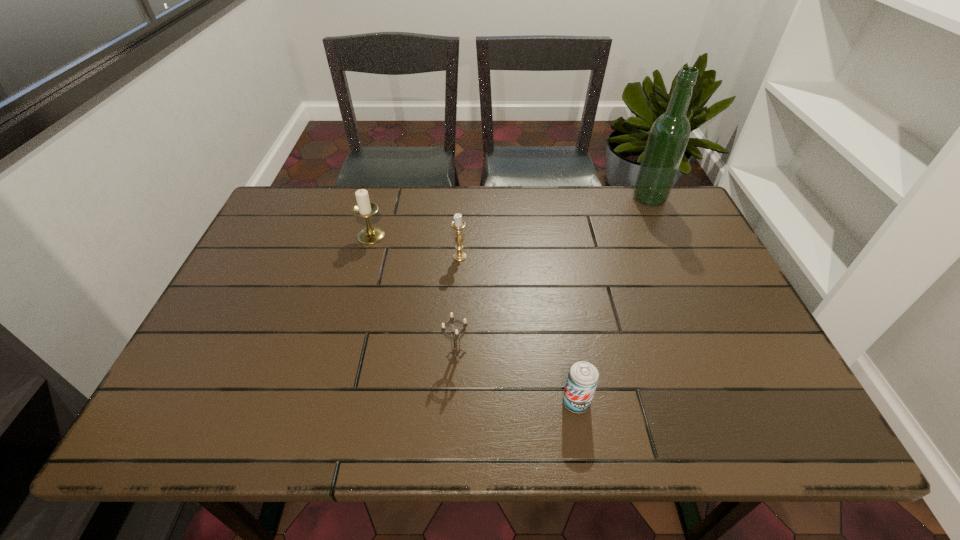
In order to click on vacant space that satisfies the following two spatial constraints: 1. on the front side of the nearest candle holder; 2. on the left side of the third farthest object in this screenshot , I will do `click(455, 355)`.

The height and width of the screenshot is (540, 960). I want to click on vacant space that satisfies the following two spatial constraints: 1. on the front side of the farthest candle holder; 2. on the right side of the shortest candle holder, so click(338, 355).

The width and height of the screenshot is (960, 540). What are the coordinates of `vacant space that satisfies the following two spatial constraints: 1. on the front side of the beer can; 2. on the right side of the third farthest object` in the screenshot? It's located at (453, 402).

Where is `vacant space that satisfies the following two spatial constraints: 1. on the front side of the nearest candle holder; 2. on the left side of the farthest candle holder`? vacant space that satisfies the following two spatial constraints: 1. on the front side of the nearest candle holder; 2. on the left side of the farthest candle holder is located at coordinates (338, 355).

The width and height of the screenshot is (960, 540). What are the coordinates of `free location that satisfies the following two spatial constraints: 1. on the front side of the leftmost candle holder; 2. on the right side of the nearest object` in the screenshot? It's located at (325, 402).